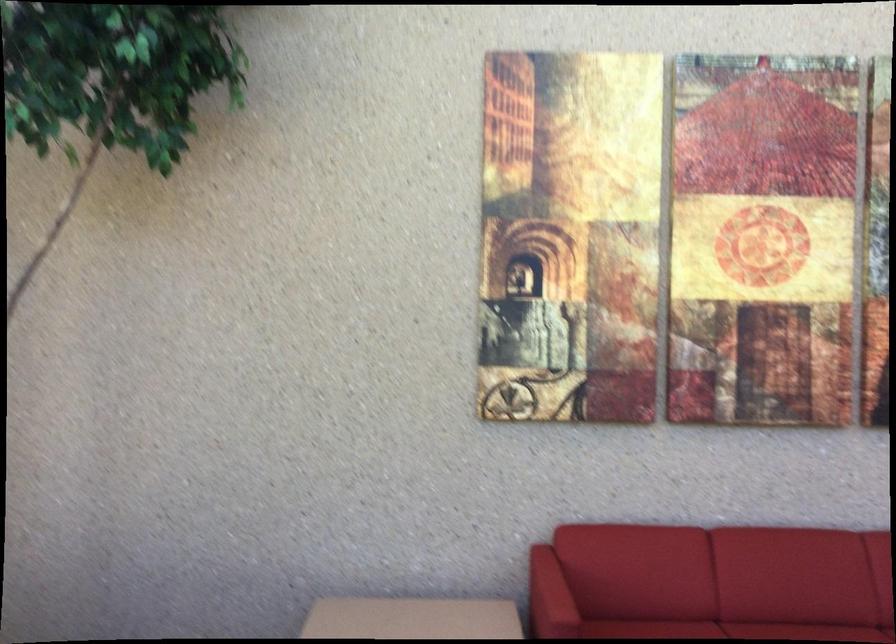
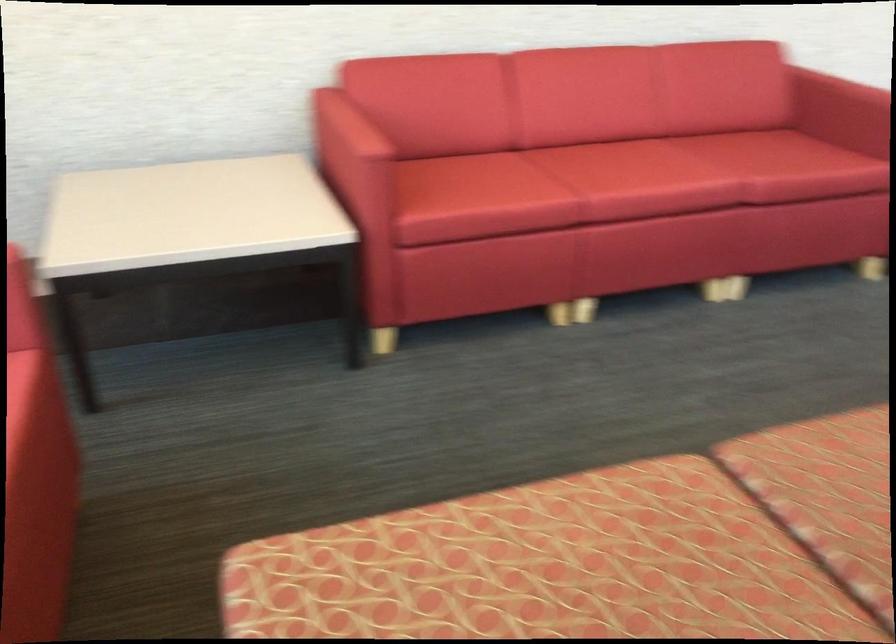
Based on the continuous images, in which direction is the camera rotating?

The rotation direction of the camera is right-down.